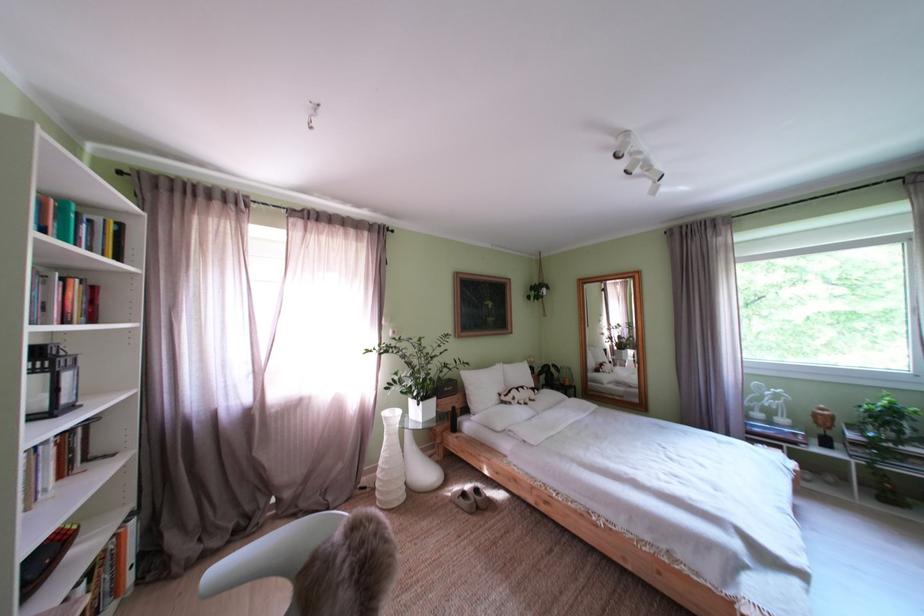
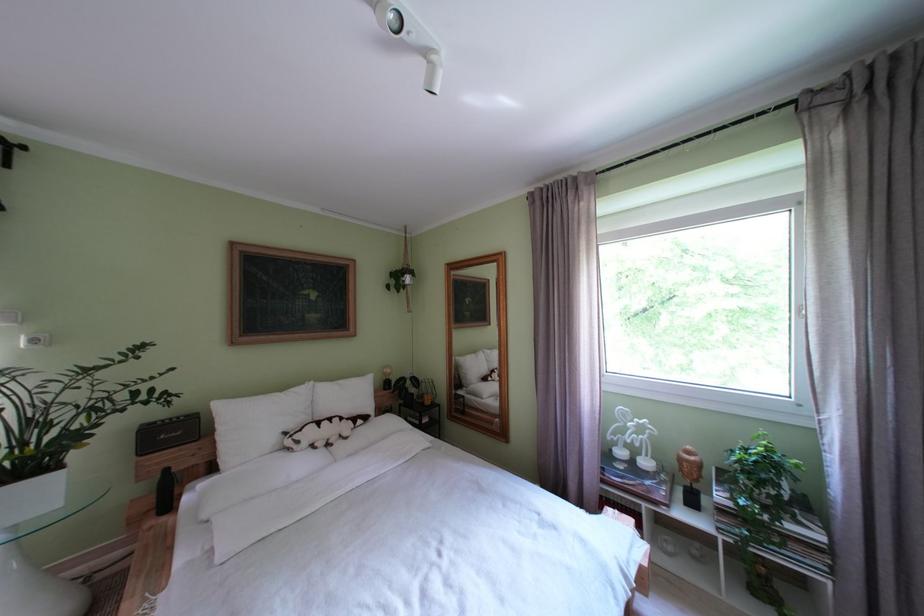
The images are taken continuously from a first-person perspective. In which direction are you moving?

The cameraman walked toward right, forward.